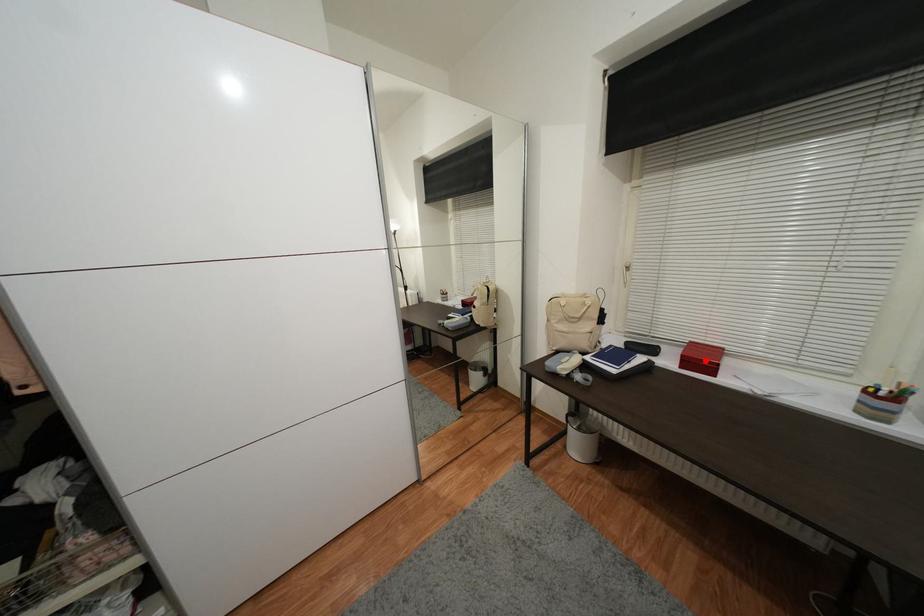
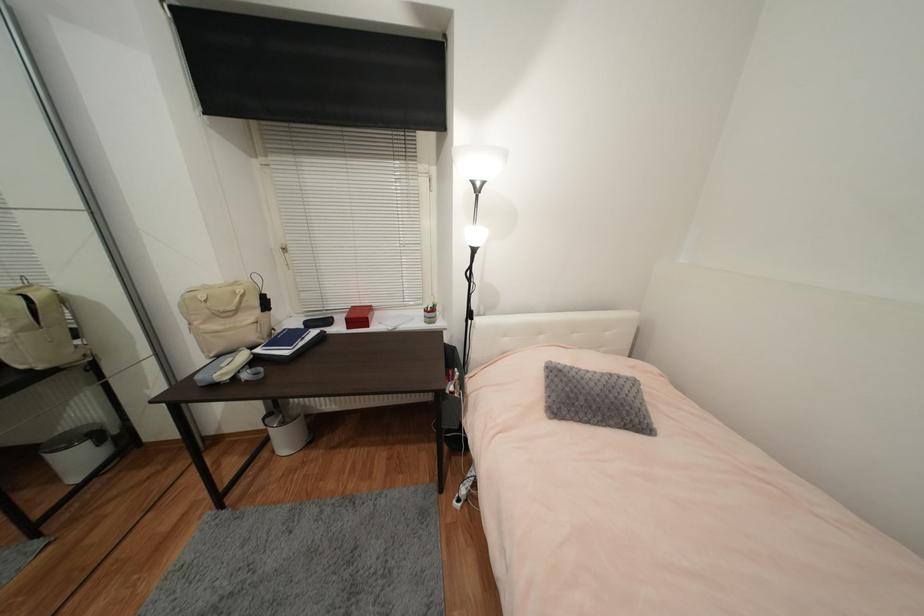
Find the pixel in the second image that matches the highlighted location in the first image.

(363, 318)